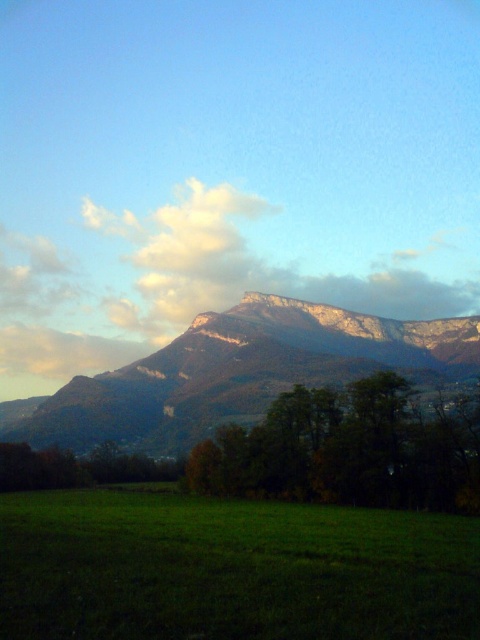
You are an airplane passenger looking out the window and see the rugged stone mountain range at center and the white fluffy cloud at upper center. Which object is closer to the left side of your view?

The white fluffy cloud at upper center is closer to the left side because the rugged stone mountain range at center is positioned on its right side.

You are standing at the center of the image. Which direction should you walk to reach the green grass at lower left?

You should walk towards the lower left direction to reach the green grass at lower left.